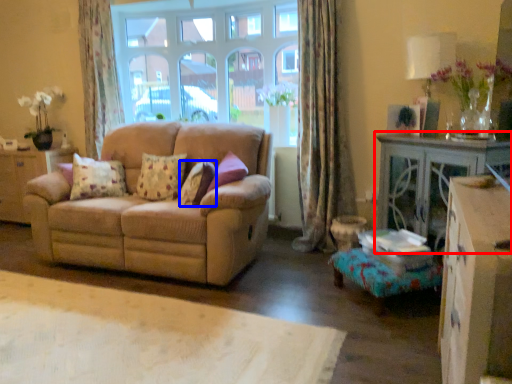
Question: Among these objects, which one is nearest to the camera, table (highlighted by a red box) or pillow (highlighted by a blue box)?

Choices:
 (A) table
 (B) pillow

Answer: (A)